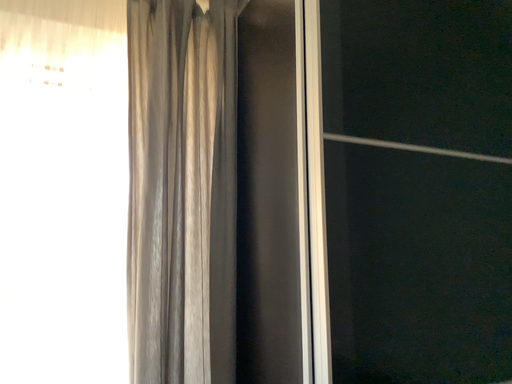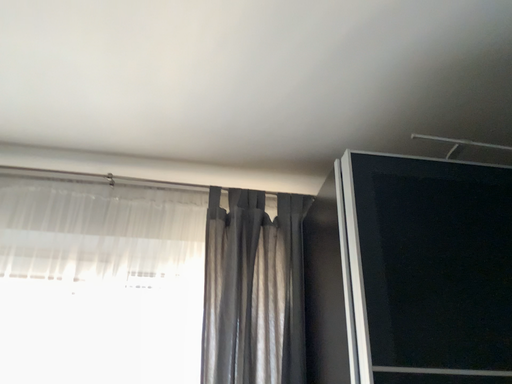
Question: Which way did the camera rotate in the video?

Choices:
 (A) rotated upward
 (B) rotated downward

Answer: (A)